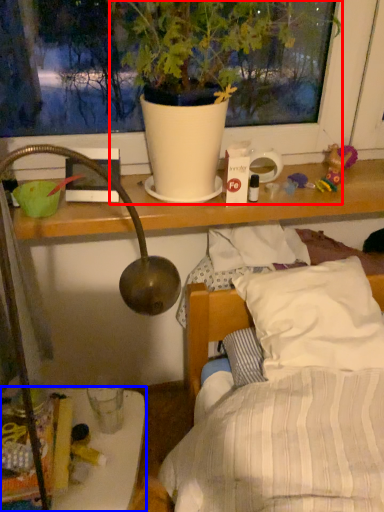
Question: Among these objects, which one is nearest to the camera, houseplant (highlighted by a red box) or furniture (highlighted by a blue box)?

Choices:
 (A) houseplant
 (B) furniture

Answer: (A)